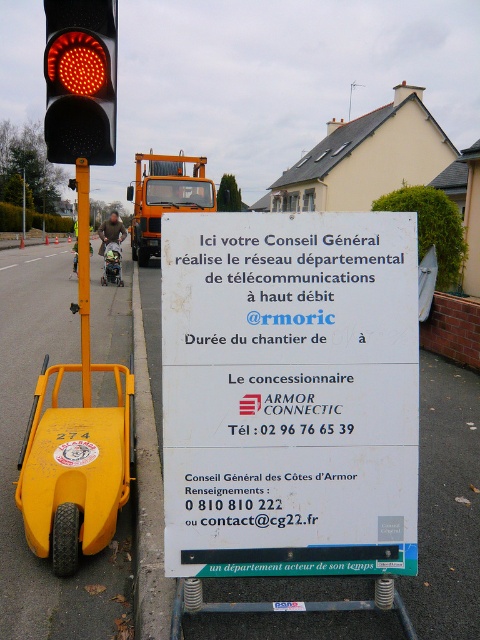
Question: Among these points, which one is nearest to the camera?

Choices:
 (A) (69, 104)
 (B) (81, 337)
 (C) (94, 429)

Answer: (A)

Question: Is white plastic sign at center to the right of yellow matte toy car at lower left from the viewer's perspective?

Choices:
 (A) no
 (B) yes

Answer: (B)

Question: Can you confirm if white plastic sign at center is smaller than matte black traffic light at upper left?

Choices:
 (A) no
 (B) yes

Answer: (B)

Question: Observing the image, what is the correct spatial positioning of white plastic sign at center in reference to yellow matte toy car at lower left?

Choices:
 (A) left
 (B) right

Answer: (B)

Question: Which object appears farthest from the camera in this image?

Choices:
 (A) yellow matte toy car at lower left
 (B) matte black traffic light at upper left
 (C) yellow plastic pole at left

Answer: (C)

Question: Which object is the farthest from the white plastic sign at center?

Choices:
 (A) matte black traffic light at upper left
 (B) yellow matte toy car at lower left

Answer: (A)